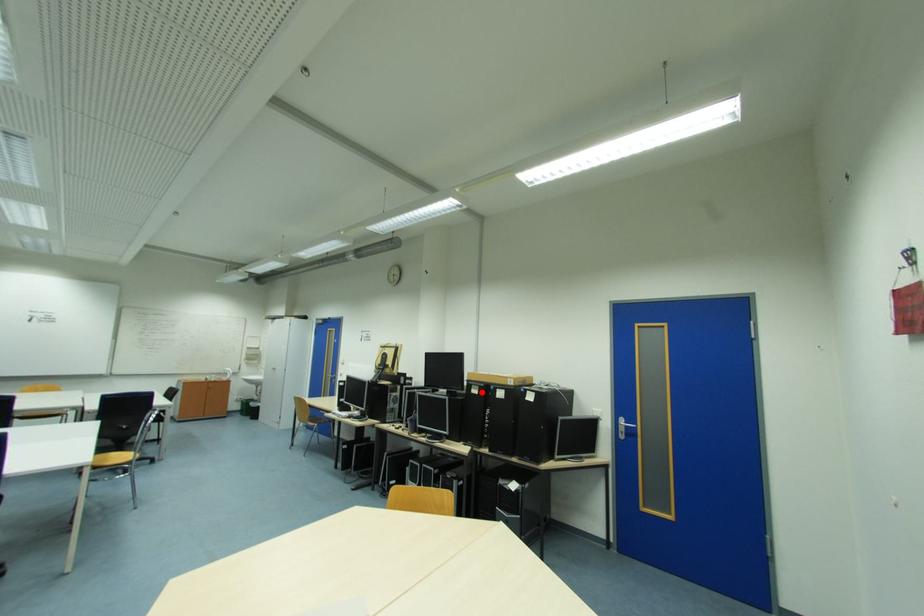
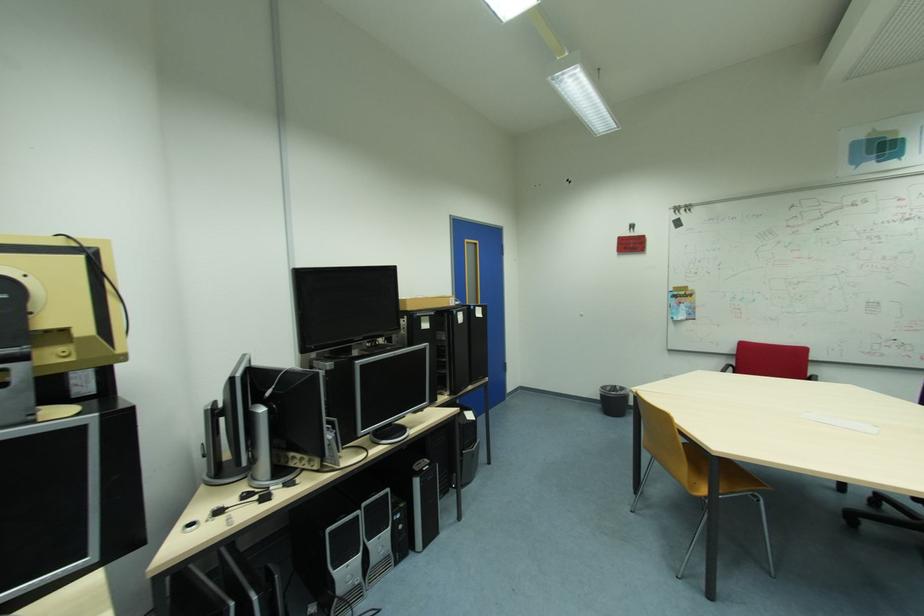
In the second image, find the point that corresponds to the highlighted location in the first image.

(432, 326)